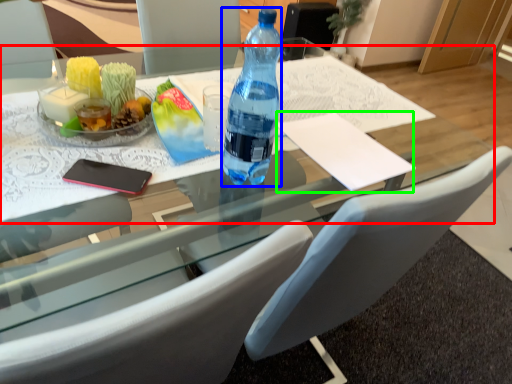
Question: Considering the real-world distances, which object is farthest from round table (highlighted by a red box)? bottle (highlighted by a blue box) or notepad (highlighted by a green box)?

Choices:
 (A) bottle
 (B) notepad

Answer: (A)